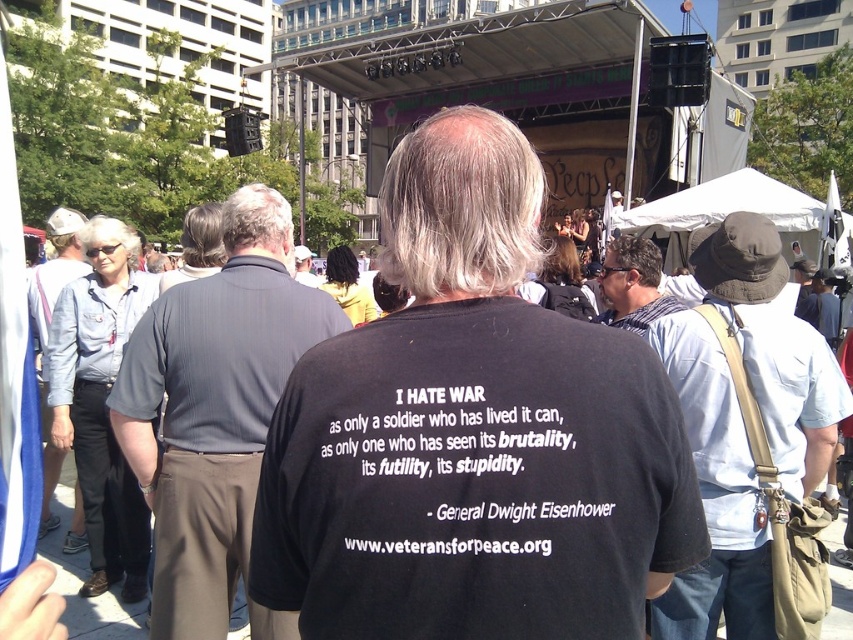
Does point (566, 432) lie in front of point (634, 250)?

Yes, it is.

The height and width of the screenshot is (640, 853). What are the coordinates of `blackmaterial/texturet-shirt at center` in the screenshot? It's located at (468, 474).

Between light blue shirt at center and blackmaterial/texturet-shirt at center, which one appears on the right side from the viewer's perspective?

light blue shirt at center

Describe the element at coordinates (743, 422) in the screenshot. I see `light blue shirt at center` at that location.

Locate an element on the screen. This screenshot has width=853, height=640. light blue shirt at center is located at coordinates (743, 422).

Does point (360, 442) come closer to viewer compared to point (415, 512)?

No.

Does point (505, 518) come behind point (469, 476)?

That is False.

At what (x,y) coordinates should I click in order to perform the action: click on black cotton t-shirt at center. Please return your answer as a coordinate pair (x, y). Looking at the image, I should click on (471, 435).